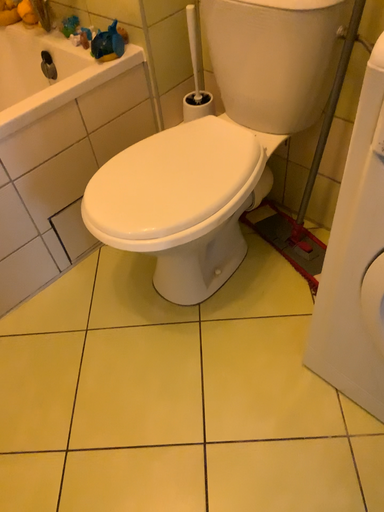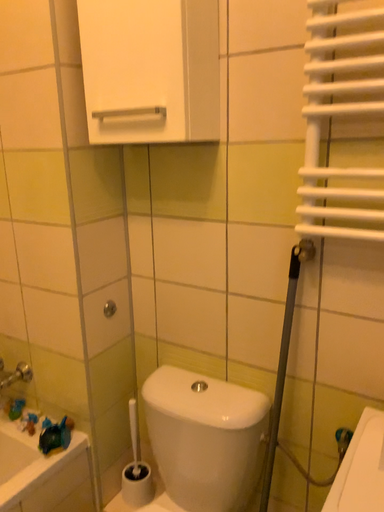
Question: How did the camera likely rotate when shooting the video?

Choices:
 (A) rotated right
 (B) rotated left

Answer: (A)